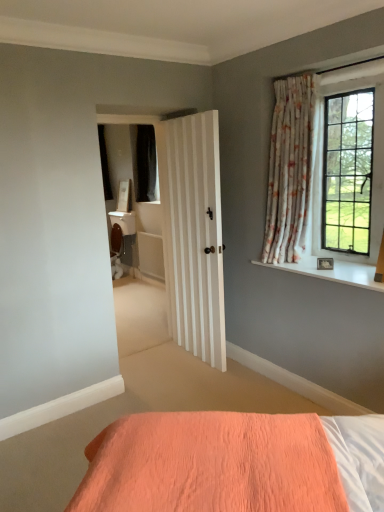
Question: Can you confirm if white smooth window sill at upper right is smaller than clear glass window at upper right?

Choices:
 (A) yes
 (B) no

Answer: (A)

Question: Is white smooth window sill at upper right shorter than clear glass window at upper right?

Choices:
 (A) no
 (B) yes

Answer: (B)

Question: Is white smooth window sill at upper right bigger than clear glass window at upper right?

Choices:
 (A) no
 (B) yes

Answer: (A)

Question: Is white smooth window sill at upper right to the left of clear glass window at upper right from the viewer's perspective?

Choices:
 (A) yes
 (B) no

Answer: (A)

Question: Is white smooth window sill at upper right looking in the opposite direction of clear glass window at upper right?

Choices:
 (A) yes
 (B) no

Answer: (B)

Question: Is the depth of white smooth window sill at upper right greater than that of clear glass window at upper right?

Choices:
 (A) no
 (B) yes

Answer: (A)

Question: Does white smooth window sill at upper right have a greater width compared to floral fabric curtain at upper right?

Choices:
 (A) no
 (B) yes

Answer: (B)

Question: From a real-world perspective, is white smooth window sill at upper right located higher than floral fabric curtain at upper right?

Choices:
 (A) yes
 (B) no

Answer: (B)

Question: From the image's perspective, does white smooth window sill at upper right appear lower than floral fabric curtain at upper right?

Choices:
 (A) no
 (B) yes

Answer: (B)

Question: Is white smooth window sill at upper right facing towards floral fabric curtain at upper right?

Choices:
 (A) no
 (B) yes

Answer: (A)

Question: Does white smooth window sill at upper right have a greater height compared to floral fabric curtain at upper right?

Choices:
 (A) yes
 (B) no

Answer: (B)

Question: Is white smooth window sill at upper right in front of floral fabric curtain at upper right?

Choices:
 (A) yes
 (B) no

Answer: (A)

Question: Is clear glass window at upper right facing towards floral fabric curtain at upper right?

Choices:
 (A) yes
 (B) no

Answer: (A)